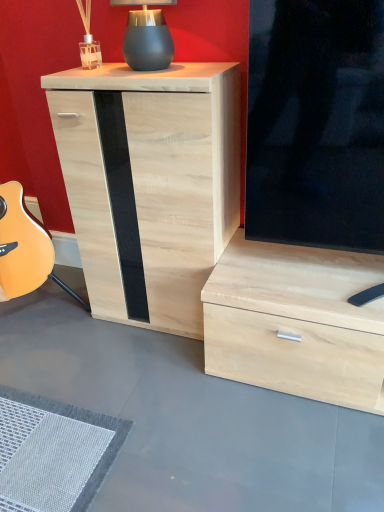
In order to click on free space in front of natural wood cabinet at center in this screenshot , I will do [x=149, y=379].